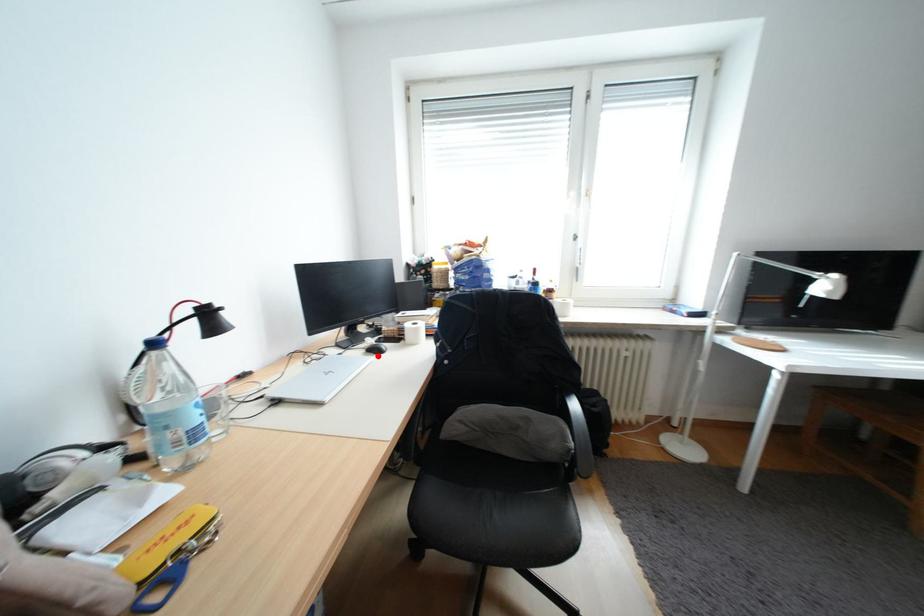
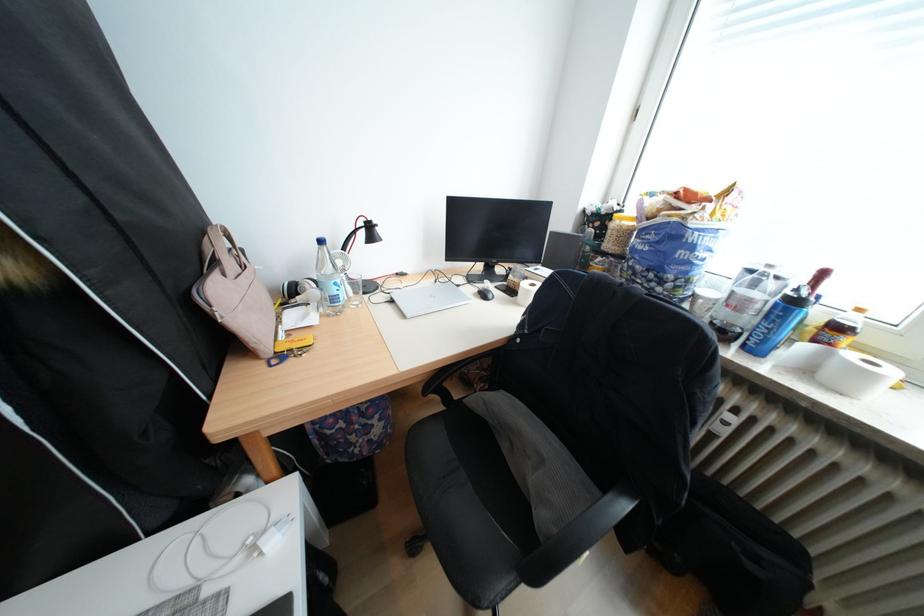
The point at the highlighted location is marked in the first image. Where is the corresponding point in the second image?

(487, 296)